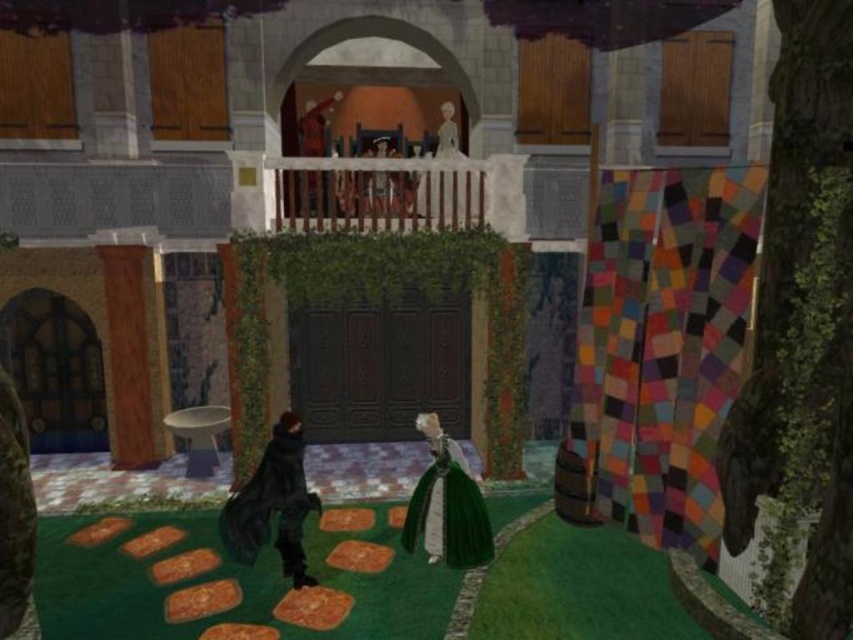
Question: Which of the following is the closest to the observer?

Choices:
 (A) black matte coat at lower left
 (B) smooth red coat at upper center
 (C) wooden pillar at left

Answer: (A)

Question: Among these points, which one is farthest from the camera?

Choices:
 (A) (454, 465)
 (B) (444, 141)
 (C) (135, 330)

Answer: (B)

Question: Which point appears farthest from the camera in this image?

Choices:
 (A) (229, 522)
 (B) (407, 518)
 (C) (451, 124)
 (D) (134, 276)

Answer: (C)

Question: Can you confirm if wooden pillar at left is smaller than smooth red coat at upper center?

Choices:
 (A) yes
 (B) no

Answer: (A)

Question: Is black matte coat at lower left above wooden pillar at left?

Choices:
 (A) yes
 (B) no

Answer: (B)

Question: Can you confirm if velvet green dress at lower center is bigger than white glossy statue at upper center?

Choices:
 (A) yes
 (B) no

Answer: (A)